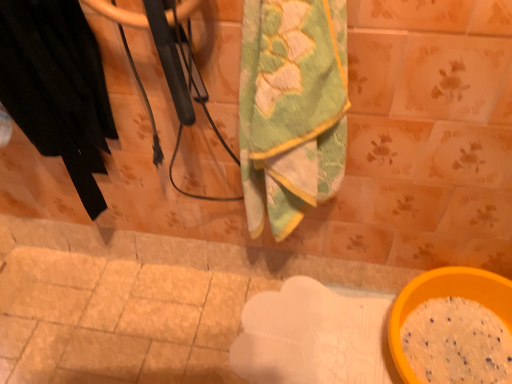
The image size is (512, 384). What are the coordinates of `yellow plastic bowl at lower right` in the screenshot? It's located at (457, 343).

In order to face black fabric at left, should I rotate leftwards or rightwards?

Turn left approximately 26.555 degrees to face it.

Where is `green textured towel at center`? green textured towel at center is located at coordinates (292, 108).

Is yellow plastic bowl at lower right far away from green textured towel at center?

No.

From the picture: From the image's perspective, which one is positioned lower, yellow plastic bowl at lower right or green textured towel at center?

yellow plastic bowl at lower right appears lower in the image.

Which object is more forward, yellow plastic bowl at lower right or green textured towel at center?

green textured towel at center.

Can you tell me how much yellow plastic bowl at lower right and green textured towel at center differ in facing direction?

yellow plastic bowl at lower right and green textured towel at center are facing 8.49 degrees away from each other.

Between point (255, 207) and point (467, 379), which one is positioned in front?

The point (255, 207) is closer.

Considering the relative sizes of green textured towel at center and yellow plastic bowl at lower right in the image provided, is green textured towel at center shorter than yellow plastic bowl at lower right?

No, green textured towel at center is not shorter than yellow plastic bowl at lower right.

Can you tell me how much green textured towel at center and yellow plastic bowl at lower right differ in facing direction?

The angular difference between green textured towel at center and yellow plastic bowl at lower right is 8.49 degrees.

Considering the points (75, 17) and (301, 183), which point is behind, point (75, 17) or point (301, 183)?

The point (301, 183) is behind.

Could green textured towel at center be considered to be inside black fabric at left?

That's incorrect, green textured towel at center is not inside black fabric at left.

Would you consider black fabric at left to be distant from green textured towel at center?

black fabric at left is near green textured towel at center, not far away.

Is black fabric at left taller or shorter than green textured towel at center?

Considering their sizes, black fabric at left has less height than green textured towel at center.

From the image's perspective, does green textured towel at center appear lower than black fabric at left?

Correct, green textured towel at center appears lower than black fabric at left in the image.

This screenshot has height=384, width=512. What are the coordinates of `towel that appears below the black fabric at left (from the image's perspective)` in the screenshot? It's located at (292, 108).

Is green textured towel at center positioned with its back to black fabric at left?

No.

Which object is further away from the camera taking this photo, yellow plastic bowl at lower right or black fabric at left?

yellow plastic bowl at lower right is behind.

Considering the sizes of objects yellow plastic bowl at lower right and black fabric at left in the image provided, who is thinner, yellow plastic bowl at lower right or black fabric at left?

With smaller width is black fabric at left.

Is yellow plastic bowl at lower right next to black fabric at left?

yellow plastic bowl at lower right and black fabric at left are not in contact.

Looking at this image, is black fabric at left in front of yellow plastic bowl at lower right?

Yes, it is in front of yellow plastic bowl at lower right.

Where is `powder that is behind the black fabric at left`? powder that is behind the black fabric at left is located at coordinates (457, 343).

Is black fabric at left situated inside yellow plastic bowl at lower right or outside?

The correct answer is: outside.

You are a GUI agent. You are given a task and a screenshot of the screen. Output one action in this format:
    pyautogui.click(x=<x>, y=<y>)
    Task: Click on the towel above the yellow plastic bowl at lower right (from a real-world perspective)
    
    Given the screenshot: What is the action you would take?
    pyautogui.click(x=292, y=108)

This screenshot has height=384, width=512. What are the coordinates of `powder that appears behind the green textured towel at center` in the screenshot? It's located at (457, 343).

Which object lies nearer to the anchor point green textured towel at center, black fabric at left or yellow plastic bowl at lower right?

Based on the image, black fabric at left appears to be nearer to green textured towel at center.

Looking at the image, which one is located further to yellow plastic bowl at lower right, green textured towel at center or black fabric at left?

Among the two, black fabric at left is located further to yellow plastic bowl at lower right.

From the image, which object appears to be nearer to black fabric at left, yellow plastic bowl at lower right or green textured towel at center?

The object closer to black fabric at left is green textured towel at center.

Based on their spatial positions, is green textured towel at center or yellow plastic bowl at lower right further from black fabric at left?

yellow plastic bowl at lower right is positioned further to the anchor black fabric at left.

Looking at the image, which one is located closer to yellow plastic bowl at lower right, black fabric at left or green textured towel at center?

green textured towel at center is positioned closer to the anchor yellow plastic bowl at lower right.

Based on their spatial positions, is yellow plastic bowl at lower right or black fabric at left further from green textured towel at center?

Based on the image, yellow plastic bowl at lower right appears to be further to green textured towel at center.

This screenshot has height=384, width=512. Identify the location of towel situated between black fabric at left and yellow plastic bowl at lower right from left to right. (292, 108).